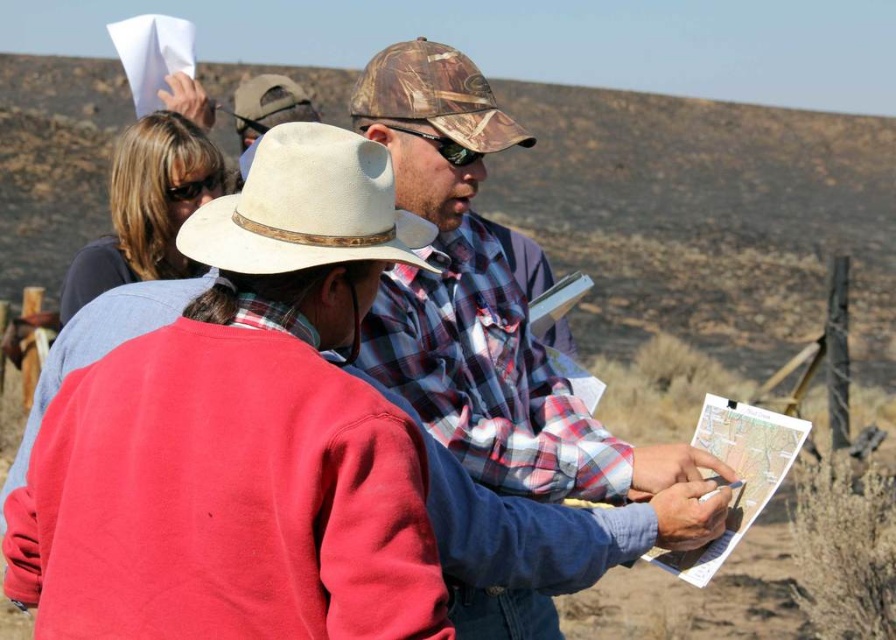
Question: Does white felt cowboy hat at center appear on the right side of white paper map at center?

Choices:
 (A) no
 (B) yes

Answer: (A)

Question: Which object appears closest to the camera in this image?

Choices:
 (A) matte red sweatshirt at center
 (B) matte black shirt at upper left
 (C) plaid flannel shirt at center

Answer: (A)

Question: Is white felt cowboy hat at center to the left of white paper map at center from the viewer's perspective?

Choices:
 (A) no
 (B) yes

Answer: (B)

Question: Estimate the real-world distances between objects in this image. Which object is closer to the camouflage fabric cowboy hat at center?

Choices:
 (A) white felt cowboy hat at center
 (B) matte black shirt at upper left

Answer: (A)

Question: Based on their relative distances, which object is nearer to the white paper map at center?

Choices:
 (A) camouflage fabric cowboy hat at center
 (B) white felt cowboy hat at center
 (C) white felt cowboy hat at upper center

Answer: (A)

Question: Is matte black shirt at upper left to the left of white paper map at center from the viewer's perspective?

Choices:
 (A) no
 (B) yes

Answer: (B)